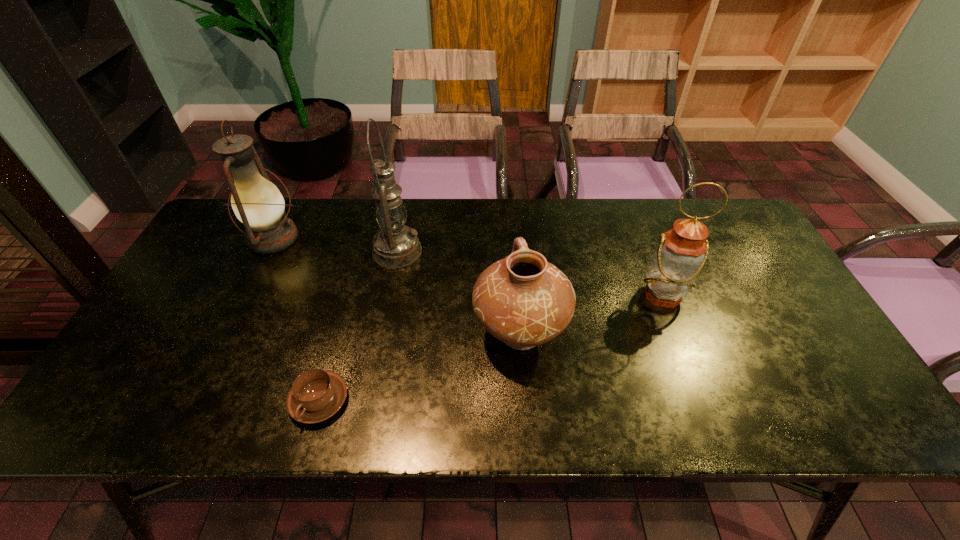
Find the location of `the second oil lamp from right to left`. the second oil lamp from right to left is located at coordinates pyautogui.click(x=396, y=245).

Find the location of `the leftmost object`. the leftmost object is located at coordinates click(x=257, y=203).

What are the coordinates of `the rightmost oil lamp` in the screenshot? It's located at (682, 252).

This screenshot has width=960, height=540. Find the location of `the nearest oil lamp`. the nearest oil lamp is located at coordinates pyautogui.click(x=682, y=252).

This screenshot has width=960, height=540. Find the location of `the fourth object from left to right`. the fourth object from left to right is located at coordinates (524, 301).

I want to click on the second shortest object, so click(524, 301).

Find the location of a particular element. This screenshot has width=960, height=540. the nearest object is located at coordinates (316, 395).

Where is `cappuccino`? cappuccino is located at coordinates pos(316,395).

I want to click on free region located 0.350m on the left of the second oil lamp from right to left, so click(x=256, y=251).

Identify the location of vacant position located 0.240m on the right of the leftmost object. (382, 238).